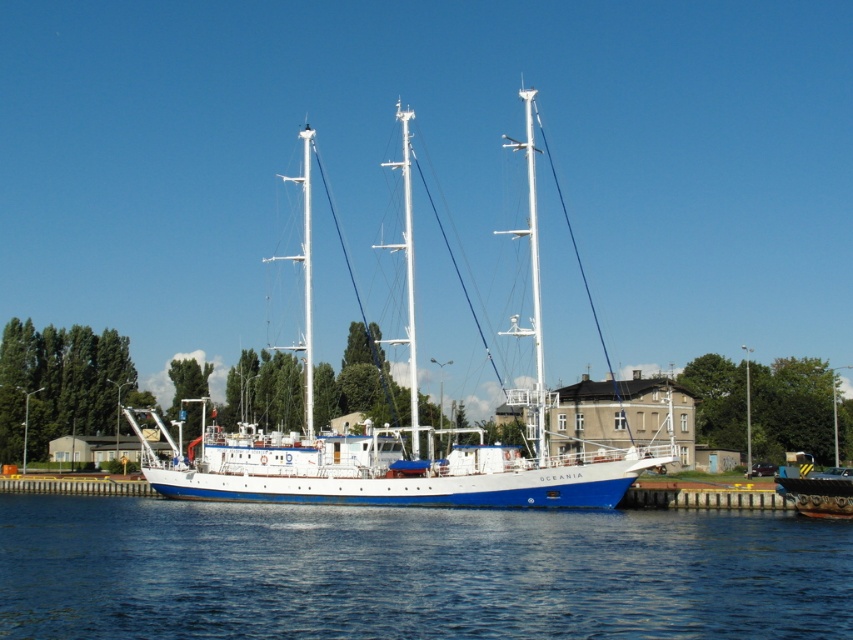
You are standing on the wooden pier and want to board the ship. Which direction should you move relative to the blue matte boat at lower right to reach the white matte sailboat at center?

You should move to the left of the blue matte boat at lower right to reach the white matte sailboat at center, as the white matte sailboat at center is positioned to the left of the blue matte boat at lower right.

You are standing on the wooden pier next to the OCEANIA ship. There is a point marked at coordinates point (74,515) that you need to reach. Considering your height is 5 feet 6 inches, can you safely step onto that point from your current position on the pier?

The point (74,515) is 258.26 feet away from the viewer. Since this distance is quite large, stepping onto that point from the current position on the pier would not be safe as the gap is too wide to jump across.

You are standing on the wooden pier next to the OCEANIA ship. You notice a point marked at coordinates (x=410, y=451). What object is located at that point?

The point at coordinates (x=410, y=451) corresponds to the white matte sailboat at center.